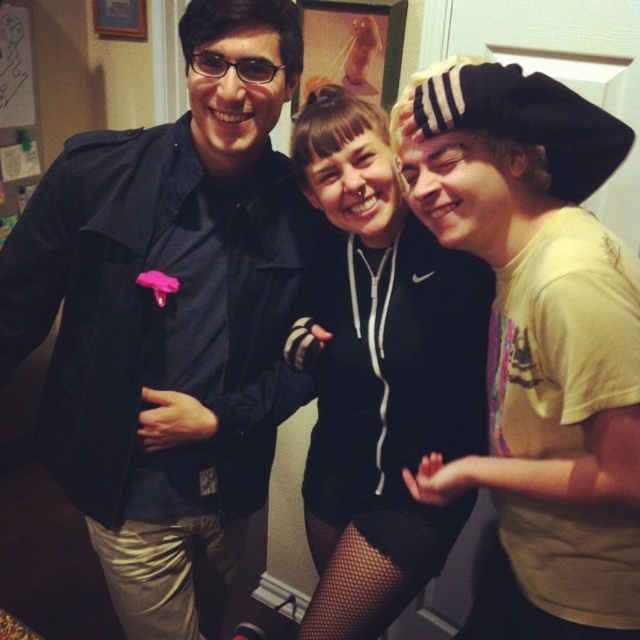
You are standing in the room where the three people are posing. You want to locate the matte black jacket at center. Where would you look relative to the other people in the image?

The matte black jacket at center is located at point (170, 320), which is at the center horizontally and slightly below the middle vertically in the image.

You are a photographer adjusting the lighting for a group photo. You notice the matte black jacket at center and the black hoodie at center. Which one is positioned lower on the person?

The matte black jacket at center is located below the black hoodie at center, so it is positioned lower on the person.

You are planning to take a photo of the matte black jacket at center and the black hoodie at center. Which one appears wider in the photo?

The matte black jacket at center appears wider than the black hoodie at center in the photo because its width surpasses that of the black hoodie at center.